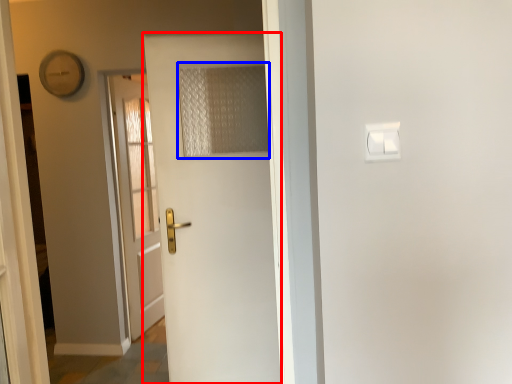
Question: Which of the following is the farthest to the observer, door (highlighted by a red box) or curtain (highlighted by a blue box)?

Choices:
 (A) door
 (B) curtain

Answer: (B)